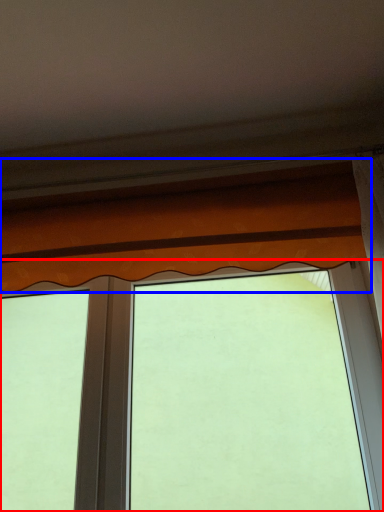
Question: Which of the following is the farthest to the observer, window (highlighted by a red box) or curtain (highlighted by a blue box)?

Choices:
 (A) window
 (B) curtain

Answer: (A)